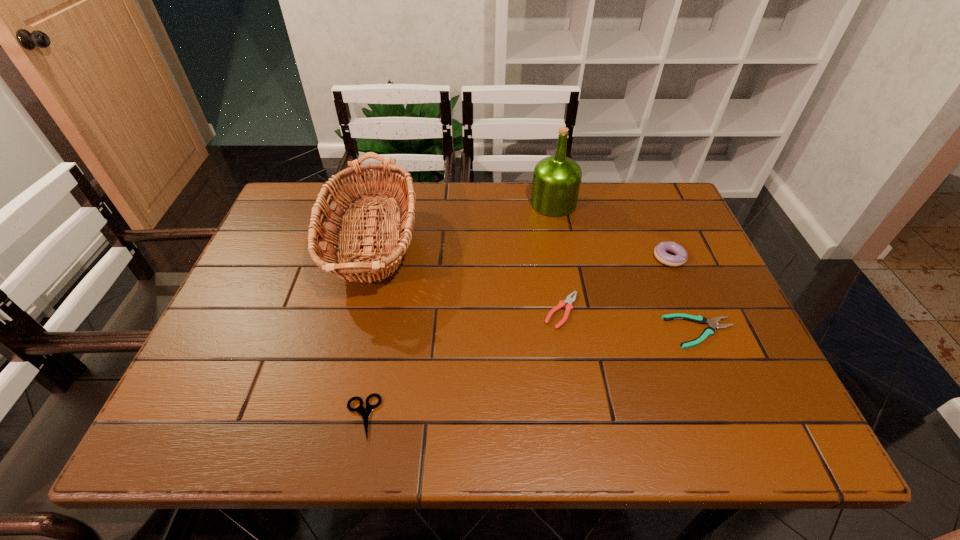
In the image, there is a desktop. Find the location of `free space at the near edge`. free space at the near edge is located at coordinates (429, 403).

This screenshot has height=540, width=960. Identify the location of vacant space at the left edge. (262, 247).

In order to click on blank space at the right edge in this screenshot , I will do `click(712, 301)`.

Image resolution: width=960 pixels, height=540 pixels. Find the location of `free space at the far left corner of the desktop`. free space at the far left corner of the desktop is located at coordinates (317, 188).

Where is `empty location between the shears and the left pliers`? The width and height of the screenshot is (960, 540). empty location between the shears and the left pliers is located at coordinates (x=462, y=364).

Image resolution: width=960 pixels, height=540 pixels. I want to click on free space that is in between the left pliers and the tallest object, so click(558, 257).

Where is `vacant space that's between the basket and the right pliers`? vacant space that's between the basket and the right pliers is located at coordinates (538, 288).

The width and height of the screenshot is (960, 540). I want to click on free space between the nearest object and the second tallest object, so (369, 330).

Locate an element on the screen. free space between the nearest object and the shorter pliers is located at coordinates (532, 375).

This screenshot has width=960, height=540. In order to click on free point between the basket and the tallest object in this screenshot , I will do `click(464, 224)`.